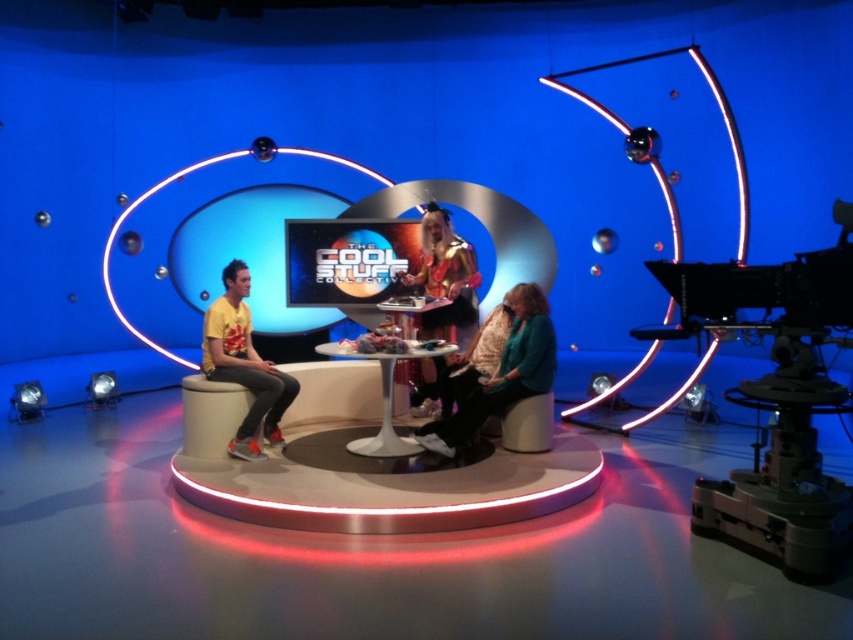
You are a stagehand preparing to move a 1.2 meter wide box onto the platform. The teal fabric jacket at center and the gold metallic costume at center are both on the table. Can both items stay on the table without being moved if the box is placed between them?

The teal fabric jacket at center might be wider than gold metallic costume at center, so there is a possibility that the box could fit between them. However, since the exact width difference isn not specified, it is uncertain if both items can remain undisturbed.

You are a camera operator in the studio. You need to zoom in on the point at coordinates (x=244, y=364). What object will this point be focused on?

The point at coordinates (x=244, y=364) is on the yellow printed t shirt at left, so zooming in will focus on the yellow printed t shirt at left.